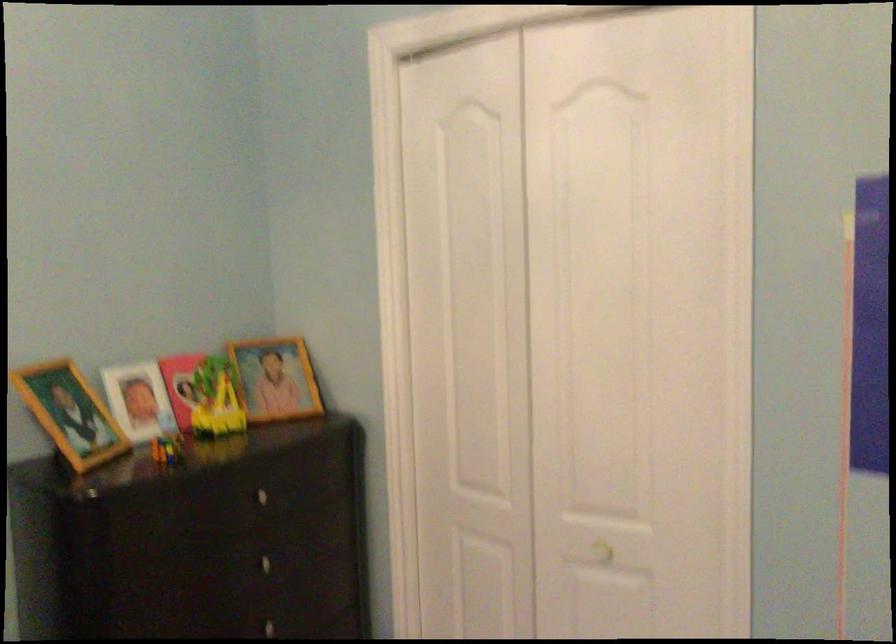
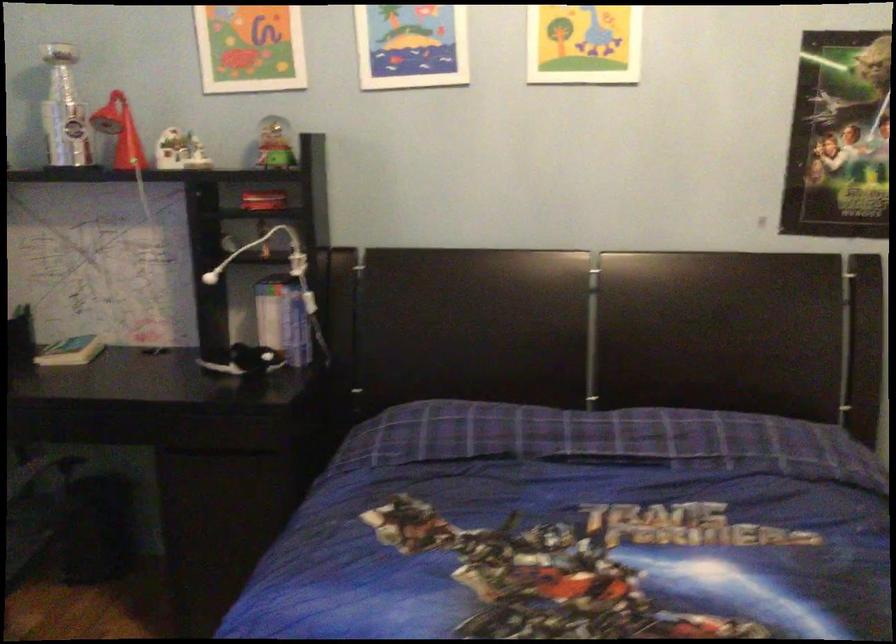
Question: How did the camera likely rotate?

Choices:
 (A) Left
 (B) Right
 (C) Up
 (D) Down

Answer: (A)